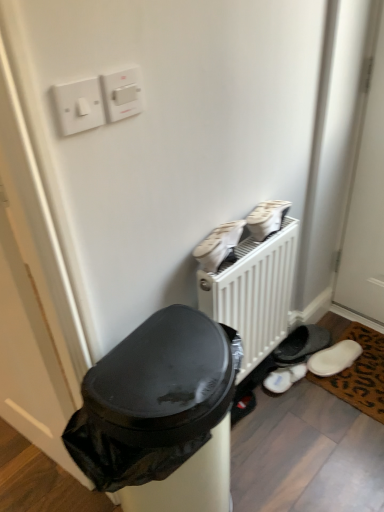
Identify the location of white fluffy slippers at lower right, the first footwear in the back-to-front sequence. The width and height of the screenshot is (384, 512). (284, 378).

Describe the element at coordinates (254, 293) in the screenshot. The image size is (384, 512). I see `white matte radiator at center` at that location.

This screenshot has height=512, width=384. Find the location of `white plastic light switch at upper center, which is the second light switch in left-to-right order`. white plastic light switch at upper center, which is the second light switch in left-to-right order is located at coordinates (122, 94).

The width and height of the screenshot is (384, 512). What do you see at coordinates (122, 94) in the screenshot?
I see `white plastic light switch at upper center, which is the second light switch in left-to-right order` at bounding box center [122, 94].

This screenshot has width=384, height=512. Describe the element at coordinates (267, 218) in the screenshot. I see `white fabric shoes at upper right, arranged as the 1th footwear when viewed from the top` at that location.

The width and height of the screenshot is (384, 512). What are the coordinates of `white plastic light switch at upper left, positioned as the second light switch in right-to-left order` in the screenshot? It's located at (79, 106).

Where is `brown leopard print mat at lower right`? brown leopard print mat at lower right is located at coordinates (357, 369).

Where is `black plastic trash can at lower left`? This screenshot has width=384, height=512. black plastic trash can at lower left is located at coordinates pyautogui.click(x=161, y=414).

The image size is (384, 512). There is a white matte radiator at center. Find the location of `the 2nd footwear above it (from a real-world perspective)`. the 2nd footwear above it (from a real-world perspective) is located at coordinates (219, 245).

Which is correct: white fabric shoes at center, the third footwear positioned from the back, is inside white matte radiator at center, or outside of it?

white fabric shoes at center, the third footwear positioned from the back, is not enclosed by white matte radiator at center.

Which is more to the left, white fabric shoes at center, the third footwear positioned from the back, or white matte radiator at center?

white fabric shoes at center, the third footwear positioned from the back, is more to the left.

Does point (287, 382) lie in front of point (217, 260)?

No, it is behind (217, 260).

Between white fluffy slippers at lower right, which is the third footwear from front to back, and white fabric shoes at center, which ranks as the second footwear in top-to-bottom order, which one has more height?

With more height is white fabric shoes at center, which ranks as the second footwear in top-to-bottom order.

Would you say white fluffy slippers at lower right, placed as the first footwear when sorted from bottom to top, is a long distance from white fabric shoes at center, acting as the second footwear starting from the bottom?

No, there isn't a large distance between white fluffy slippers at lower right, placed as the first footwear when sorted from bottom to top, and white fabric shoes at center, acting as the second footwear starting from the bottom.

How different are the orientations of white fluffy slippers at lower right, which is the third footwear from front to back, and white fabric shoes at center, the 1th footwear in the front-to-back sequence, in degrees?

The facing directions of white fluffy slippers at lower right, which is the third footwear from front to back, and white fabric shoes at center, the 1th footwear in the front-to-back sequence, are 9.21 degrees apart.

I want to click on the 2nd footwear directly above the black plastic trash can at lower left (from a real-world perspective), so click(x=219, y=245).

Is white fabric shoes at center, acting as the second footwear starting from the bottom, touching black plastic trash can at lower left?

There is a gap between white fabric shoes at center, acting as the second footwear starting from the bottom, and black plastic trash can at lower left.

Can we say white fabric shoes at center, which ranks as the second footwear in top-to-bottom order, lies outside black plastic trash can at lower left?

That's correct, white fabric shoes at center, which ranks as the second footwear in top-to-bottom order, is outside of black plastic trash can at lower left.

Considering the sizes of objects white fabric shoes at center, the third footwear positioned from the back, and black plastic trash can at lower left in the image provided, who is wider, white fabric shoes at center, the third footwear positioned from the back, or black plastic trash can at lower left?

With larger width is black plastic trash can at lower left.

Can you confirm if white matte radiator at center is taller than white plastic light switch at upper left, which appears as the 1th light switch when viewed from the left?

Indeed, white matte radiator at center has a greater height compared to white plastic light switch at upper left, which appears as the 1th light switch when viewed from the left.

From the image's perspective, is white matte radiator at center located above white plastic light switch at upper left, which appears as the 1th light switch when viewed from the left?

No, from the image's perspective, white matte radiator at center is not above white plastic light switch at upper left, which appears as the 1th light switch when viewed from the left.

From a real-world perspective, starting from the white matte radiator at center, which light switch is the 2nd one vertically above it? Please provide its 2D coordinates.

[(79, 106)]

From a real-world perspective, is white matte radiator at center positioned above or below white plastic light switch at upper left, positioned as the second light switch in right-to-left order?

In terms of real-world spatial position, white matte radiator at center is below white plastic light switch at upper left, positioned as the second light switch in right-to-left order.

From the picture: Considering their positions, is white plastic light switch at upper left, positioned as the second light switch in right-to-left order, located in front of or behind white fabric shoes at upper right, arranged as the 1th footwear when viewed from the top?

Visually, white plastic light switch at upper left, positioned as the second light switch in right-to-left order, is located in front of white fabric shoes at upper right, arranged as the 1th footwear when viewed from the top.

Which object is positioned more to the left, white plastic light switch at upper left, positioned as the second light switch in right-to-left order, or white fabric shoes at upper right, positioned as the 2th footwear in front-to-back order?

white plastic light switch at upper left, positioned as the second light switch in right-to-left order.

From a real-world perspective, is white plastic light switch at upper left, positioned as the second light switch in right-to-left order, physically located above or below white fabric shoes at upper right, acting as the third footwear starting from the bottom?

white plastic light switch at upper left, positioned as the second light switch in right-to-left order, is situated higher than white fabric shoes at upper right, acting as the third footwear starting from the bottom, in the real world.

What's the angular difference between white plastic light switch at upper left, positioned as the second light switch in right-to-left order, and white fabric shoes at upper right, arranged as the 1th footwear when viewed from the top,'s facing directions?

The facing directions of white plastic light switch at upper left, positioned as the second light switch in right-to-left order, and white fabric shoes at upper right, arranged as the 1th footwear when viewed from the top, are 2.7 degrees apart.

From the image's perspective, is brown leopard print mat at lower right located above white matte radiator at center?

Incorrect, from the image's perspective, brown leopard print mat at lower right is lower than white matte radiator at center.

In the scene shown: Is white matte radiator at center at the back of brown leopard print mat at lower right?

No, white matte radiator at center is not at the back of brown leopard print mat at lower right.

Is brown leopard print mat at lower right inside the boundaries of white matte radiator at center, or outside?

brown leopard print mat at lower right cannot be found inside white matte radiator at center.

Is black plastic trash can at lower left wider or thinner than white fabric shoes at upper right, positioned as the 2th footwear in front-to-back order?

black plastic trash can at lower left is wider than white fabric shoes at upper right, positioned as the 2th footwear in front-to-back order.

How much distance is there between black plastic trash can at lower left and white fabric shoes at upper right, arranged as the 1th footwear when viewed from the top?

black plastic trash can at lower left and white fabric shoes at upper right, arranged as the 1th footwear when viewed from the top, are 51.42 centimeters apart from each other.

Would you say black plastic trash can at lower left is a long distance from white fabric shoes at upper right, placed as the 2th footwear when sorted from back to front?

They are positioned close to each other.

Considering the relative sizes of black plastic trash can at lower left and white fabric shoes at upper right, placed as the 2th footwear when sorted from back to front, in the image provided, is black plastic trash can at lower left shorter than white fabric shoes at upper right, placed as the 2th footwear when sorted from back to front,?

No.

Image resolution: width=384 pixels, height=512 pixels. Find the location of `radiator behind the white fabric shoes at center, the third footwear positioned from the back`. radiator behind the white fabric shoes at center, the third footwear positioned from the back is located at coordinates (254, 293).

The width and height of the screenshot is (384, 512). Identify the location of footwear that is the 1st one when counting upward from the white fluffy slippers at lower right, placed as the first footwear when sorted from bottom to top (from the image's perspective). (219, 245).

Estimate the real-world distances between objects in this image. Which object is closer to white plastic light switch at upper left, which appears as the 1th light switch when viewed from the left, black plastic trash can at lower left or white fabric shoes at upper right, positioned as the 2th footwear in front-to-back order?

Among the two, white fabric shoes at upper right, positioned as the 2th footwear in front-to-back order, is located nearer to white plastic light switch at upper left, which appears as the 1th light switch when viewed from the left.

Which object lies nearer to the anchor point white fluffy slippers at lower right, the first footwear in the back-to-front sequence, brown leopard print mat at lower right or white matte radiator at center?

Among the two, brown leopard print mat at lower right is located nearer to white fluffy slippers at lower right, the first footwear in the back-to-front sequence.

Considering their positions, is white plastic light switch at upper left, which appears as the 1th light switch when viewed from the left, positioned closer to brown leopard print mat at lower right than white matte radiator at center?

Based on the image, white matte radiator at center appears to be nearer to brown leopard print mat at lower right.

Considering their positions, is brown leopard print mat at lower right positioned further to white matte radiator at center than black plastic trash can at lower left?

brown leopard print mat at lower right is positioned further to the anchor white matte radiator at center.

Based on their spatial positions, is white plastic light switch at upper left, positioned as the second light switch in right-to-left order, or brown leopard print mat at lower right further from white plastic light switch at upper center, which is the second light switch in left-to-right order?

brown leopard print mat at lower right is further to white plastic light switch at upper center, which is the second light switch in left-to-right order.

Looking at the image, which one is located closer to white plastic light switch at upper center, which is the second light switch in left-to-right order, white fabric shoes at center, the third footwear positioned from the back, or white fluffy slippers at lower right, which is the third footwear from front to back?

white fabric shoes at center, the third footwear positioned from the back, lies closer to white plastic light switch at upper center, which is the second light switch in left-to-right order, than the other object.

From the image, which object appears to be farther from black plastic trash can at lower left, white plastic light switch at upper left, which appears as the 1th light switch when viewed from the left, or white fluffy slippers at lower right, placed as the first footwear when sorted from bottom to top?

Based on the image, white fluffy slippers at lower right, placed as the first footwear when sorted from bottom to top, appears to be further to black plastic trash can at lower left.

Looking at the image, which one is located closer to white fluffy slippers at lower right, which is the third footwear in top-to-bottom order, white plastic light switch at upper left, positioned as the second light switch in right-to-left order, or white matte radiator at center?

white matte radiator at center.

Image resolution: width=384 pixels, height=512 pixels. What are the coordinates of `doormat located between black plastic trash can at lower left and white fluffy slippers at lower right, which is the third footwear in top-to-bottom order, in the depth direction` in the screenshot? It's located at (357, 369).

This screenshot has height=512, width=384. I want to click on light switch positioned between white plastic light switch at upper left, positioned as the second light switch in right-to-left order, and white fabric shoes at center, the 1th footwear in the front-to-back sequence, from near to far, so point(122,94).

Identify the location of radiator situated between white plastic light switch at upper center, the 1th light switch viewed from the right, and brown leopard print mat at lower right from left to right. This screenshot has height=512, width=384. (254, 293).

The image size is (384, 512). Identify the location of doormat positioned between white matte radiator at center and white fluffy slippers at lower right, which is the third footwear in top-to-bottom order, from near to far. (357, 369).